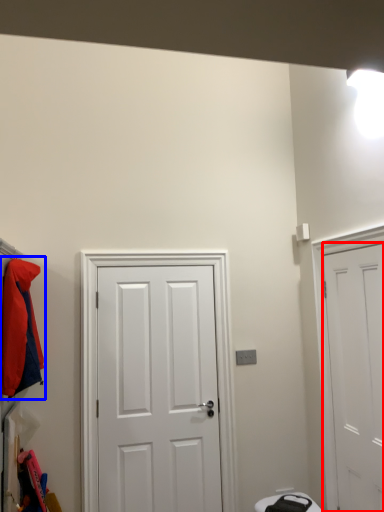
Question: Which object appears farthest to the camera in this image, door (highlighted by a red box) or jacket (highlighted by a blue box)?

Choices:
 (A) door
 (B) jacket

Answer: (B)